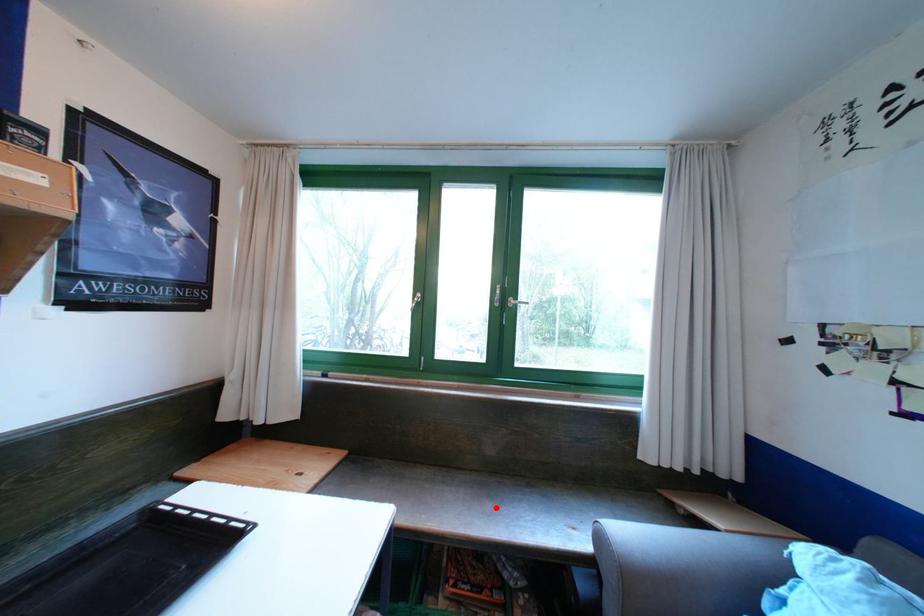
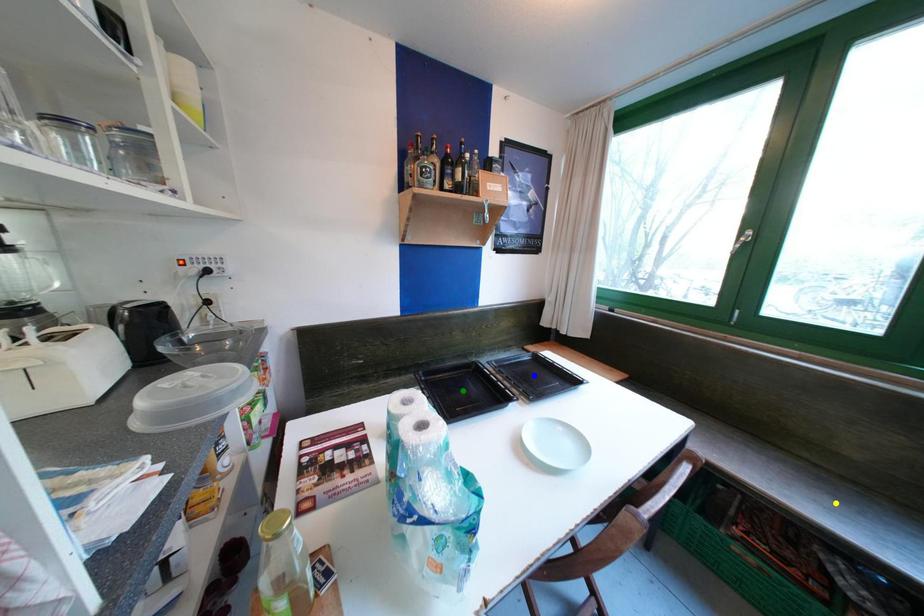
Question: I am providing you with two images of the same scene from different viewpoints. A red point is marked on the first image. You are given multiple points on the second image. Which mark in image 2 goes with the point in image 1?

Choices:
 (A) blue point
 (B) green point
 (C) yellow point

Answer: (C)